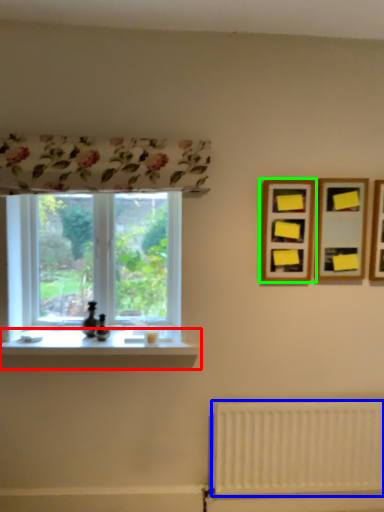
Question: Considering the real-world distances, which object is closest to window sill (highlighted by a red box)? radiator (highlighted by a blue box) or picture frame (highlighted by a green box).

Choices:
 (A) radiator
 (B) picture frame

Answer: (A)